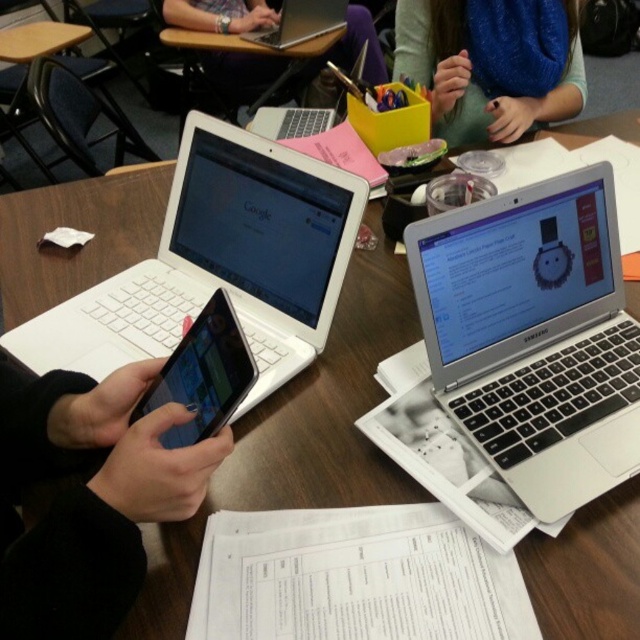
Question: Considering the relative positions of black matte phone at center and black glossy tablet at center in the image provided, where is black matte phone at center located with respect to black glossy tablet at center?

Choices:
 (A) above
 (B) below

Answer: (B)

Question: Based on their relative distances, which object is nearer to the matte black laptop at upper center?

Choices:
 (A) silver metallic laptop at upper center
 (B) white matte laptop at left

Answer: (A)

Question: In this image, where is silver metallic laptop at center-right located relative to black matte phone at center?

Choices:
 (A) left
 (B) right

Answer: (B)

Question: Which is farther from the matte black laptop at upper center?

Choices:
 (A) silver metallic laptop at center-right
 (B) white matte laptop at left
 (C) blue knitted sweater at upper center
 (D) black matte phone at center

Answer: (D)

Question: Which object is closer to the camera taking this photo?

Choices:
 (A) silver metallic laptop at upper center
 (B) white matte laptop at left

Answer: (B)

Question: Can you confirm if black matte phone at center is positioned below black glossy tablet at center?

Choices:
 (A) yes
 (B) no

Answer: (A)